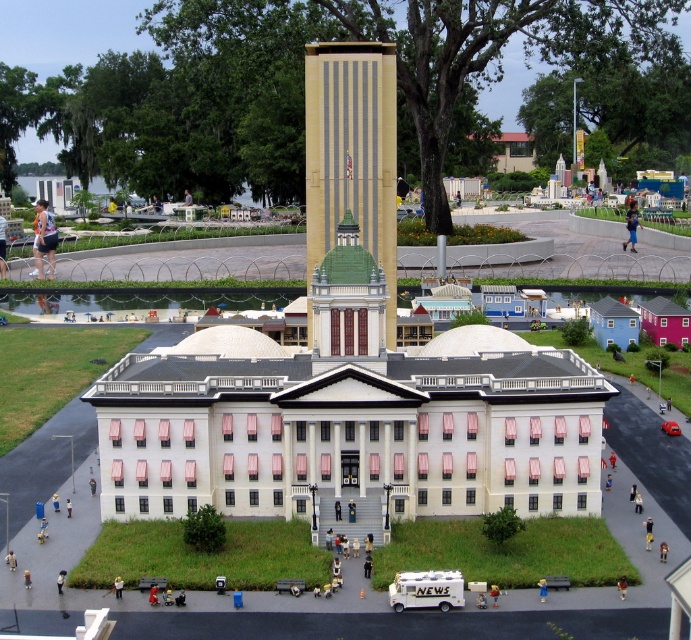
Which is more to the right, beige textured tower at center or light blue jeans at center?

beige textured tower at center

Is beige textured tower at center smaller than light blue jeans at center?

No.

Which is in front, point (392, 332) or point (6, 236)?

Positioned in front is point (392, 332).

The image size is (691, 640). I want to click on beige textured tower at center, so click(350, 152).

Which is below, beige textured tower at center or matte black shorts at lower left?

matte black shorts at lower left is lower down.

Is beige textured tower at center in front of matte black shorts at lower left?

That is True.

What do you see at coordinates (350, 152) in the screenshot?
I see `beige textured tower at center` at bounding box center [350, 152].

Identify the location of beige textured tower at center. The height and width of the screenshot is (640, 691). (350, 152).

Between matte black shorts at lower left and light blue jeans at center, which one has more height?

Standing taller between the two is matte black shorts at lower left.

Find the location of a particular element. matte black shorts at lower left is located at coordinates (44, 237).

Locate an element on the screen. Image resolution: width=691 pixels, height=640 pixels. matte black shorts at lower left is located at coordinates (44, 237).